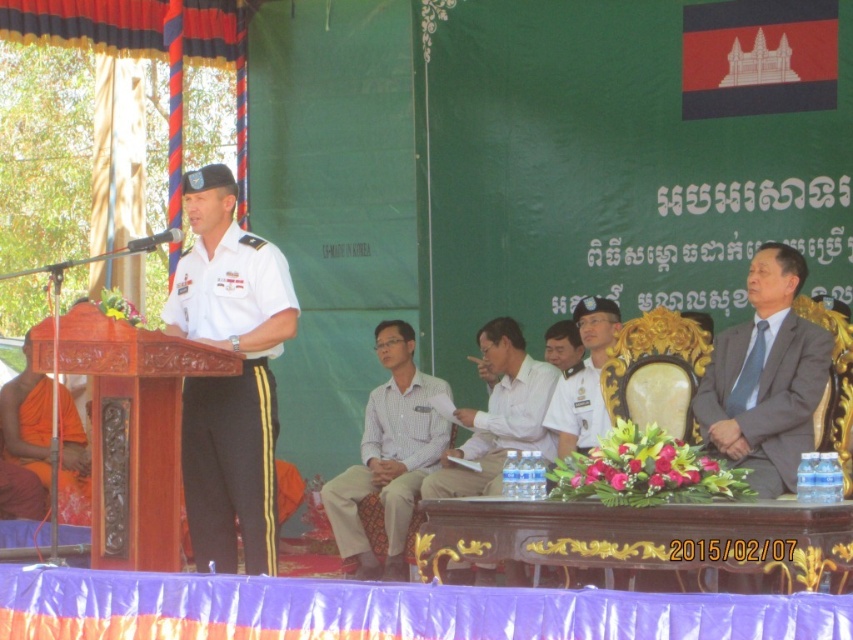
In the scene shown: You are a photographer at the event and want to capture a photo of the satin gray suit at right and orange cloth at left. Which object will appear larger in the photo?

The satin gray suit at right will appear larger in the photo because it is closer to the viewer than the orange cloth at left.

From the picture: You are a photographer standing at the camera position. You want to capture a closeup of the satin gray suit at right. Given that your camera has a maximum zoom range of 10 meters, will you be able to focus on the suit without moving closer?

The satin gray suit at right is 21.63 meters from camera, which exceeds the camera maximum zoom range of 10 meters. Therefore, you cannot focus on the suit without moving closer.

From the picture: You are a photographer positioned at the front of the stage. You want to capture a photo that includes both the satin gray suit at right and the white shirt at center. Given that your camera has a maximum focus range of 7 meters, will you be able to capture both subjects in focus?

The satin gray suit at right and white shirt at center are 7.78 meters apart. Since the distance between them exceeds the camera maximum focus range of 7 meters, you cannot capture both subjects in focus.